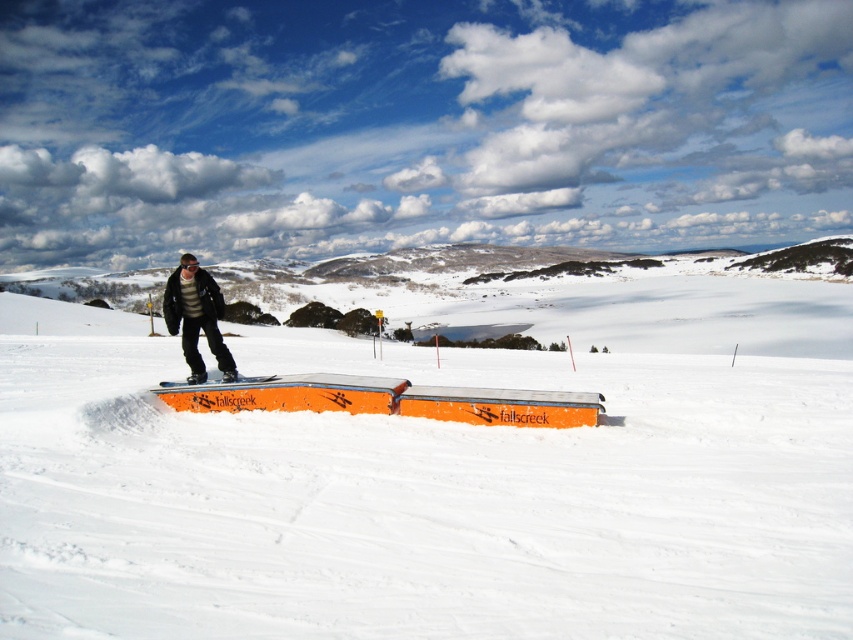
Does white smooth snow at center lie in front of orange matte snowboard at center?

Yes, it is.

Is point (814, 500) closer to viewer compared to point (218, 378)?

Yes, it is in front of point (218, 378).

Locate an element on the screen. The image size is (853, 640). white smooth snow at center is located at coordinates (434, 483).

Is the position of white smooth snow at center less distant than that of matte black jacket at center?

Yes.

Can you confirm if white smooth snow at center is positioned above matte black jacket at center?

Incorrect, white smooth snow at center is not positioned above matte black jacket at center.

The image size is (853, 640). What do you see at coordinates (434, 483) in the screenshot?
I see `white smooth snow at center` at bounding box center [434, 483].

Find the location of `white smooth snow at center`. white smooth snow at center is located at coordinates click(x=434, y=483).

Which of these two, matte black jacket at center or orange matte snowboard at center, stands shorter?

orange matte snowboard at center

Does matte black jacket at center have a lesser width compared to orange matte snowboard at center?

Yes, matte black jacket at center is thinner than orange matte snowboard at center.

What are the coordinates of `matte black jacket at center` in the screenshot? It's located at (196, 316).